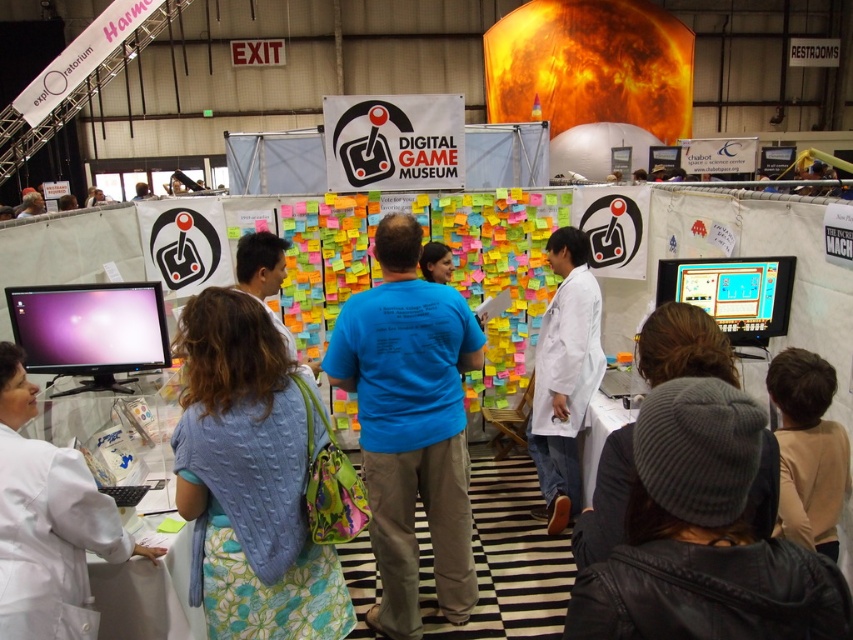
Question: Which point is closer to the camera?

Choices:
 (A) white lab coat at center
 (B) beige sweater at lower right
 (C) gray knit beanie at center
 (D) matte black monitor at lower left

Answer: (C)

Question: Is blue cotton t-shirt at center further to camera compared to matte plastic computer monitor at center?

Choices:
 (A) yes
 (B) no

Answer: (B)

Question: Is gray knit hat at lower right further to the viewer compared to blue knitted sweater at center?

Choices:
 (A) no
 (B) yes

Answer: (A)

Question: Observing the image, what is the correct spatial positioning of blue knitted sweater at center in reference to white lab coat at center?

Choices:
 (A) left
 (B) right

Answer: (A)

Question: Considering the real-world distances, which object is farthest from the white lab coat at center?

Choices:
 (A) white lab coat at left
 (B) gray knit beanie at center

Answer: (A)

Question: Among these points, which one is farthest from the camera?

Choices:
 (A) (32, 352)
 (B) (718, 292)
 (C) (541, 390)

Answer: (C)